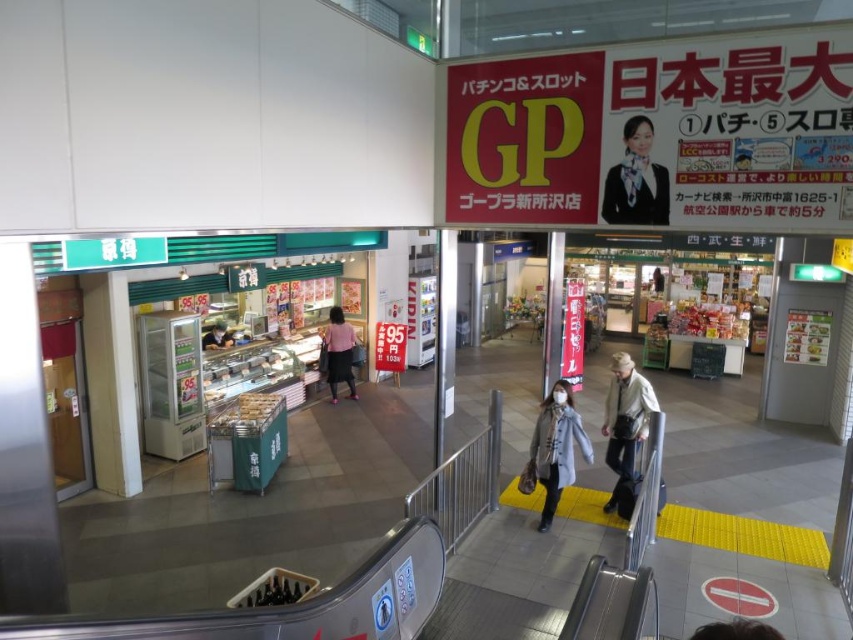
Does matte black bag at center appear under matte black uniform at upper right?

Correct, matte black bag at center is located below matte black uniform at upper right.

Between matte black bag at center and matte black uniform at upper right, which one is positioned higher?

matte black uniform at upper right is above.

Between point (619, 444) and point (628, 211), which one is positioned in front?

Point (628, 211) is more forward.

Locate an element on the screen. The height and width of the screenshot is (640, 853). matte black bag at center is located at coordinates (625, 424).

Is point (637, 422) closer to viewer compared to point (218, 339)?

Yes.

Looking at this image, can you confirm if matte black bag at center is wider than matte pink shirt at center?

Yes, matte black bag at center is wider than matte pink shirt at center.

Who is more distant from viewer, (x=619, y=369) or (x=207, y=346)?

The point (x=207, y=346) is more distant.

Locate an element on the screen. This screenshot has height=640, width=853. matte black bag at center is located at coordinates pyautogui.click(x=625, y=424).

Is light gray wool coat at center in front of matte pink shirt at center?

Yes, it is.

The width and height of the screenshot is (853, 640). Describe the element at coordinates (556, 448) in the screenshot. I see `light gray wool coat at center` at that location.

Does point (561, 406) come farther from viewer compared to point (206, 346)?

That is False.

Locate an element on the screen. The width and height of the screenshot is (853, 640). light gray wool coat at center is located at coordinates (556, 448).